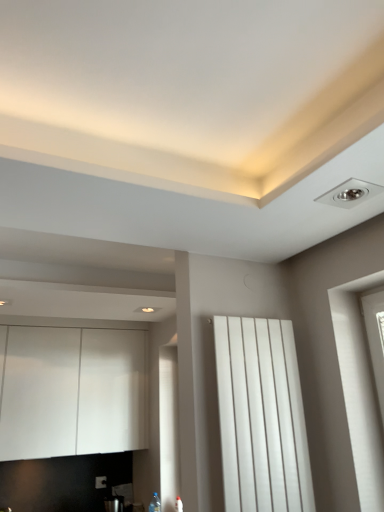
Measure the distance between point (281,457) and camera.

A distance of 5.98 feet exists between point (281,457) and camera.

What do you see at coordinates (261, 417) in the screenshot? I see `white matte radiator at center` at bounding box center [261, 417].

The image size is (384, 512). Identify the location of white matte radiator at center. (261, 417).

What is the approximate width of white matte cabinet at left?

white matte cabinet at left is 17.18 inches wide.

What do you see at coordinates (72, 391) in the screenshot? I see `white matte cabinet at left` at bounding box center [72, 391].

Locate an element on the screen. white matte cabinet at left is located at coordinates point(72,391).

Locate an element on the screen. This screenshot has height=512, width=384. white matte radiator at center is located at coordinates coord(261,417).

Would you say white matte cabinet at left is to the left or to the right of white matte radiator at center in the picture?

white matte cabinet at left is positioned on white matte radiator at center's left side.

From the picture: Is white matte cabinet at left further to the viewer compared to white matte radiator at center?

That is True.

Is point (13, 389) farther from camera compared to point (286, 420)?

Yes, point (13, 389) is farther from viewer.

From the image's perspective, which one is positioned lower, white matte cabinet at left or white matte radiator at center?

white matte cabinet at left appears lower in the image.

From a real-world perspective, which object rests below the other?

white matte radiator at center, from a real-world perspective.

Based on the photo, does white matte cabinet at left have a greater width compared to white matte radiator at center?

Yes, white matte cabinet at left is wider than white matte radiator at center.

Between white matte cabinet at left and white matte radiator at center, which one has more height?

Standing taller between the two is white matte cabinet at left.

Does white matte cabinet at left have a smaller size compared to white matte radiator at center?

No.

Would you say white matte cabinet at left contains white matte radiator at center?

Actually, white matte radiator at center is outside white matte cabinet at left.

Is white matte cabinet at left directly adjacent to white matte radiator at center?

white matte cabinet at left is not next to white matte radiator at center, and they're not touching.

Based on the photo, is white matte cabinet at left facing towards white matte radiator at center?

Yes, white matte cabinet at left is turned towards white matte radiator at center.

Can you tell me how much white matte cabinet at left and white matte radiator at center differ in facing direction?

There is a 0.266-degree angle between the facing directions of white matte cabinet at left and white matte radiator at center.

Measure the distance from white matte cabinet at left to white matte radiator at center.

The distance of white matte cabinet at left from white matte radiator at center is 2.18 meters.

Identify the location of cabinetry above the white matte radiator at center (from a real-world perspective). (72, 391).

Which object is positioned more to the right, white matte radiator at center or white matte cabinet at left?

white matte radiator at center.

Is white matte radiator at center positioned in front of white matte cabinet at left?

Yes, it is in front of white matte cabinet at left.

Does point (282, 488) lie behind point (82, 348)?

No, (282, 488) is in front of (82, 348).

From the image's perspective, would you say white matte radiator at center is shown under white matte cabinet at left?

No, from the image's perspective, white matte radiator at center is not beneath white matte cabinet at left.

From a real-world perspective, is white matte radiator at center positioned under white matte cabinet at left based on gravity?

Correct, in the physical world, white matte radiator at center is lower than white matte cabinet at left.

Is white matte radiator at center wider than white matte cabinet at left?

No.

Which of these two, white matte radiator at center or white matte cabinet at left, stands shorter?

With less height is white matte radiator at center.

Considering the sizes of objects white matte radiator at center and white matte cabinet at left in the image provided, who is bigger, white matte radiator at center or white matte cabinet at left?

white matte cabinet at left.

Would you say white matte radiator at center is inside or outside white matte cabinet at left?

The correct answer is: outside.

Is white matte radiator at center far from white matte cabinet at left?

Absolutely, white matte radiator at center is distant from white matte cabinet at left.

Does white matte radiator at center turn towards white matte cabinet at left?

No, white matte radiator at center does not turn towards white matte cabinet at left.

How distant is white matte radiator at center from white matte cabinet at left?

white matte radiator at center is 7.16 feet away from white matte cabinet at left.

This screenshot has height=512, width=384. In order to click on cabinetry that is on the left side of white matte radiator at center in this screenshot , I will do `click(72, 391)`.

This screenshot has height=512, width=384. In order to click on cabinetry that appears below the white matte radiator at center (from the image's perspective) in this screenshot , I will do `click(72, 391)`.

Where is `cabinetry that appears on the left of white matte radiator at center`? The image size is (384, 512). cabinetry that appears on the left of white matte radiator at center is located at coordinates (x=72, y=391).